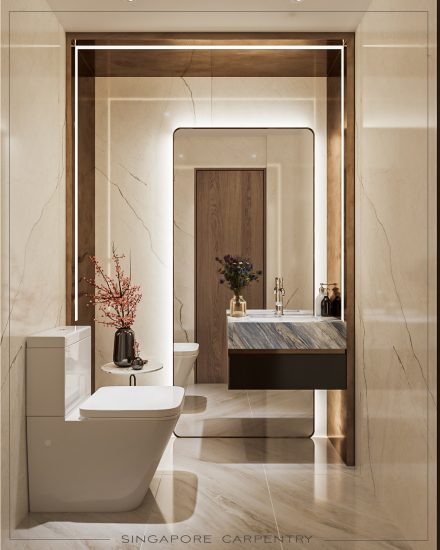
The height and width of the screenshot is (550, 440). I want to click on flower decoration in vase, so click(124, 335), click(237, 301).